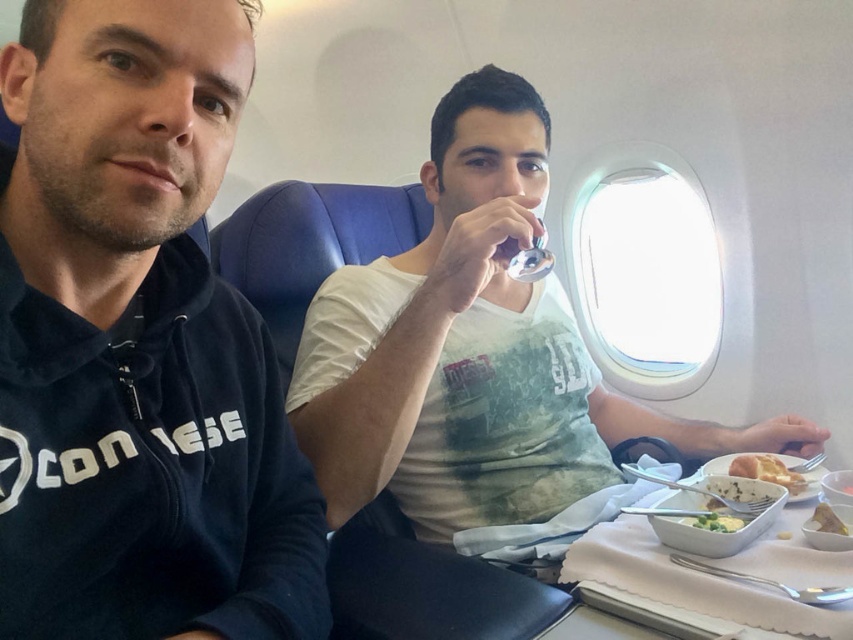
Can you confirm if white matte bread at lower right is positioned above white creamy bowl at lower center?

Yes.

Based on the photo, between white matte bread at lower right and white creamy bowl at lower center, which one appears on the right side from the viewer's perspective?

white matte bread at lower right is more to the right.

Measure the distance between point (833, 509) and camera.

Point (833, 509) and camera are 37.47 inches apart from each other.

Locate an element on the screen. white matte bread at lower right is located at coordinates (833, 518).

The height and width of the screenshot is (640, 853). I want to click on golden bread at right, so click(767, 470).

I want to click on golden bread at right, so click(767, 470).

Can you confirm if transparent glass airplane window at center is positioned to the left of golden bread at right?

Incorrect, transparent glass airplane window at center is not on the left side of golden bread at right.

Image resolution: width=853 pixels, height=640 pixels. What do you see at coordinates (643, 269) in the screenshot?
I see `transparent glass airplane window at center` at bounding box center [643, 269].

The image size is (853, 640). In order to click on transparent glass airplane window at center in this screenshot , I will do `click(643, 269)`.